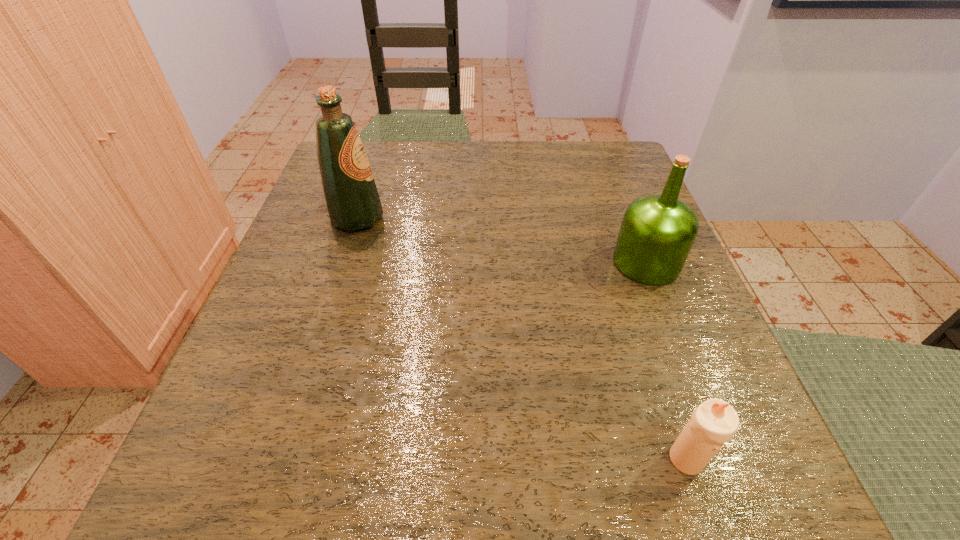
Image resolution: width=960 pixels, height=540 pixels. Find the location of `the closest object to the farthest object`. the closest object to the farthest object is located at coordinates (657, 233).

You are a GUI agent. You are given a task and a screenshot of the screen. Output one action in this format:
    pyautogui.click(x=<x>, y=<y>)
    Task: Click on the vacant space that satisfies the following two spatial constraints: 1. on the front-facing side of the farthest object; 2. on the left side of the shortest object
    Image resolution: width=960 pixels, height=540 pixels.
    Given the screenshot: What is the action you would take?
    pyautogui.click(x=279, y=460)

You are a GUI agent. You are given a task and a screenshot of the screen. Output one action in this format:
    pyautogui.click(x=<x>, y=<y>)
    Task: Click on the free space that satisfies the following two spatial constraints: 1. on the front-facing side of the candle; 2. on the right side of the farther olive oil
    This screenshot has width=960, height=540.
    Given the screenshot: What is the action you would take?
    pyautogui.click(x=279, y=460)

Find the location of a particular element. vacant point that satisfies the following two spatial constraints: 1. on the back side of the nearest object; 2. on the front-facing side of the taller olive oil is located at coordinates (607, 219).

Where is `vacant space that satisfies the following two spatial constraints: 1. on the front-facing side of the left olive oil; 2. on the back side of the nearest object`? This screenshot has width=960, height=540. vacant space that satisfies the following two spatial constraints: 1. on the front-facing side of the left olive oil; 2. on the back side of the nearest object is located at coordinates (279, 460).

Find the location of `vacant area that satisfies the following two spatial constraints: 1. on the front-facing side of the shortest object; 2. on the left side of the taller olive oil`. vacant area that satisfies the following two spatial constraints: 1. on the front-facing side of the shortest object; 2. on the left side of the taller olive oil is located at coordinates (279, 460).

Where is `free space that satisfies the following two spatial constraints: 1. on the back side of the shorter olive oil; 2. on the front-facing side of the tallest object`? This screenshot has width=960, height=540. free space that satisfies the following two spatial constraints: 1. on the back side of the shorter olive oil; 2. on the front-facing side of the tallest object is located at coordinates (630, 219).

Locate an element on the screen. The width and height of the screenshot is (960, 540). free point that satisfies the following two spatial constraints: 1. on the front-facing side of the candle; 2. on the left side of the left olive oil is located at coordinates (279, 460).

Find the location of a particular element. The image size is (960, 540). free space that satisfies the following two spatial constraints: 1. on the back side of the nearer olive oil; 2. on the front-facing side of the tallest object is located at coordinates (630, 219).

Identify the location of free region that satisfies the following two spatial constraints: 1. on the front-facing side of the second shortest object; 2. on the left side of the left olive oil. The width and height of the screenshot is (960, 540). (343, 262).